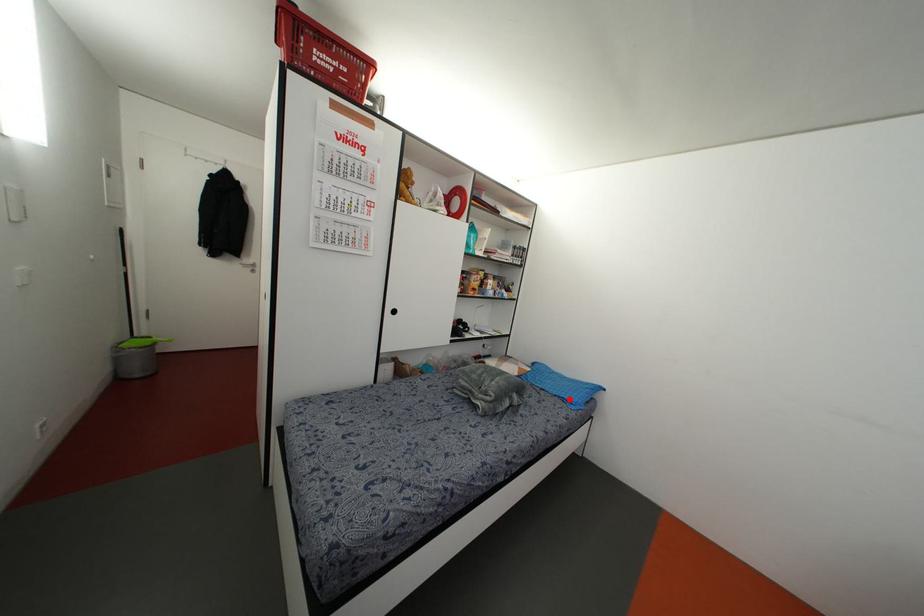
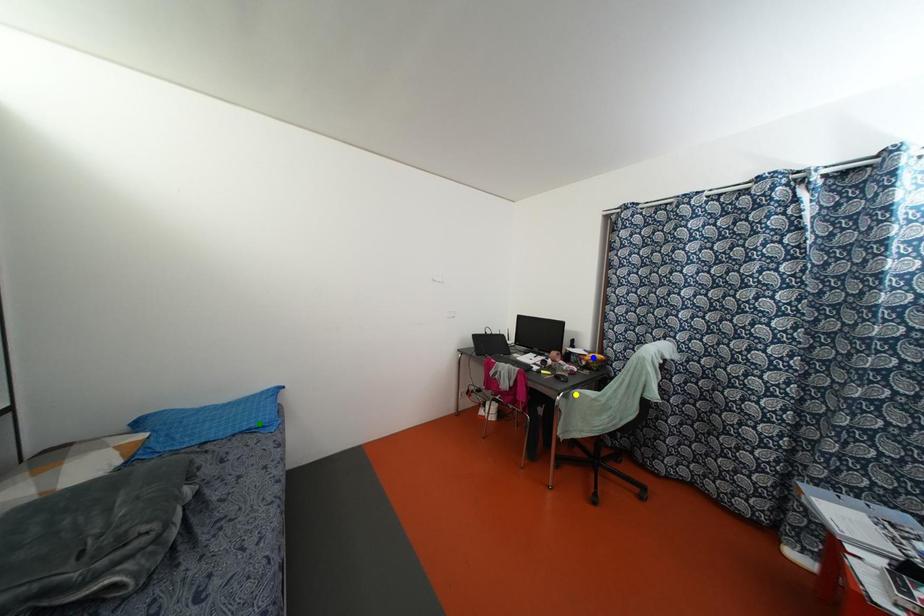
Question: I am providing you with two images of the same scene from different viewpoints. A red point is marked on the first image. You are given multiple points on the second image. Which point in image 2 represents the same 3d spot as the red point in image 1?

Choices:
 (A) blue point
 (B) yellow point
 (C) green point

Answer: (C)